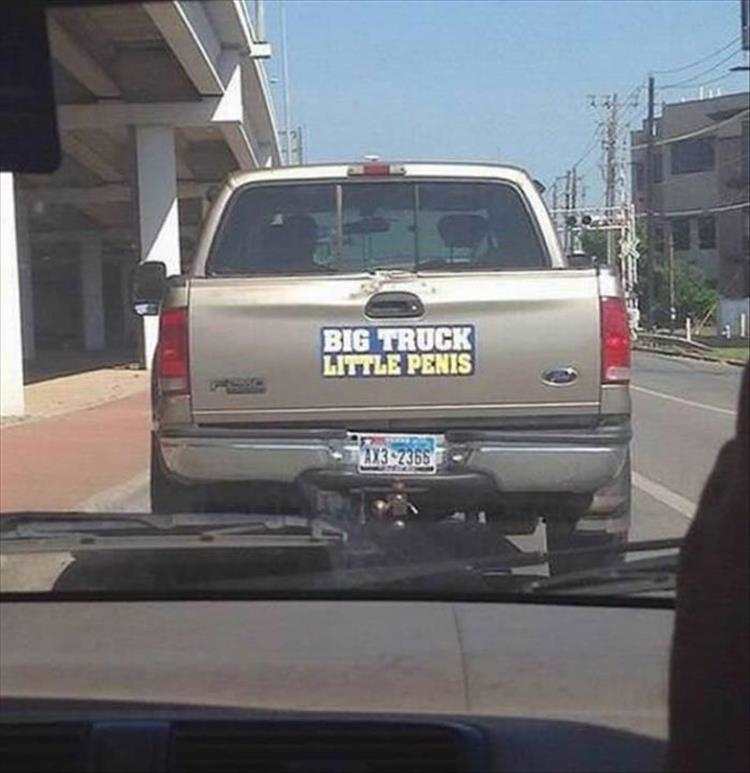
The height and width of the screenshot is (773, 750). In order to click on mirrors in this screenshot , I will do `click(154, 298)`, `click(576, 244)`.